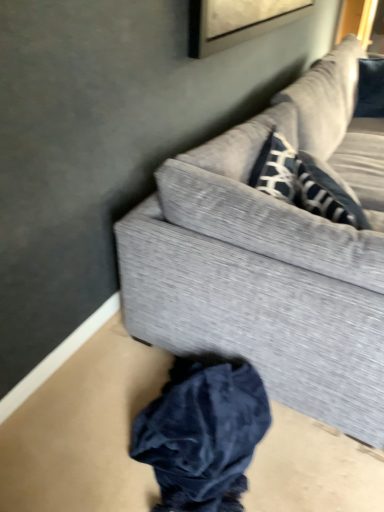
Question: From a real-world perspective, is textured gray couch at upper right beneath dark blue velvet clothing at lower center?

Choices:
 (A) no
 (B) yes

Answer: (A)

Question: From a real-world perspective, does textured gray couch at upper right stand above dark blue velvet clothing at lower center?

Choices:
 (A) yes
 (B) no

Answer: (A)

Question: Is textured gray couch at upper right taller than dark blue velvet clothing at lower center?

Choices:
 (A) yes
 (B) no

Answer: (A)

Question: From the image's perspective, is textured gray couch at upper right located beneath dark blue velvet clothing at lower center?

Choices:
 (A) no
 (B) yes

Answer: (A)

Question: Is textured gray couch at upper right further to the viewer compared to dark blue velvet clothing at lower center?

Choices:
 (A) no
 (B) yes

Answer: (A)

Question: Is textured gray couch at upper right directly adjacent to dark blue velvet clothing at lower center?

Choices:
 (A) no
 (B) yes

Answer: (A)

Question: Can you confirm if dark blue velvet clothing at lower center is positioned to the left of textured gray couch at upper right?

Choices:
 (A) no
 (B) yes

Answer: (B)

Question: Considering the relative sizes of dark blue velvet clothing at lower center and textured gray couch at upper right in the image provided, is dark blue velvet clothing at lower center thinner than textured gray couch at upper right?

Choices:
 (A) no
 (B) yes

Answer: (B)

Question: Is dark blue velvet clothing at lower center oriented towards textured gray couch at upper right?

Choices:
 (A) no
 (B) yes

Answer: (A)

Question: Is dark blue velvet clothing at lower center facing away from textured gray couch at upper right?

Choices:
 (A) no
 (B) yes

Answer: (A)

Question: Is dark blue velvet clothing at lower center positioned before textured gray couch at upper right?

Choices:
 (A) no
 (B) yes

Answer: (A)

Question: Is dark blue velvet clothing at lower center wider than textured gray couch at upper right?

Choices:
 (A) yes
 (B) no

Answer: (B)

Question: Is textured gray couch at upper right taller or shorter than dark blue velvet clothing at lower center?

Choices:
 (A) tall
 (B) short

Answer: (A)